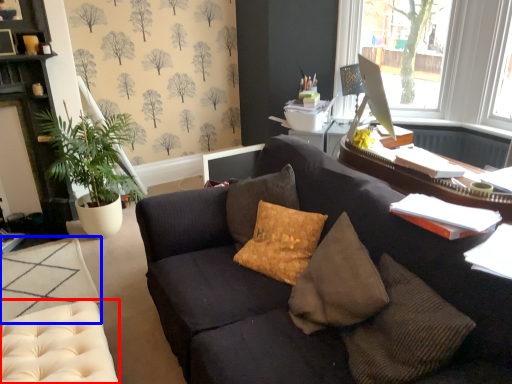
Question: Which object is further to the camera taking this photo, swivel chair (highlighted by a red box) or footrest (highlighted by a blue box)?

Choices:
 (A) swivel chair
 (B) footrest

Answer: (B)